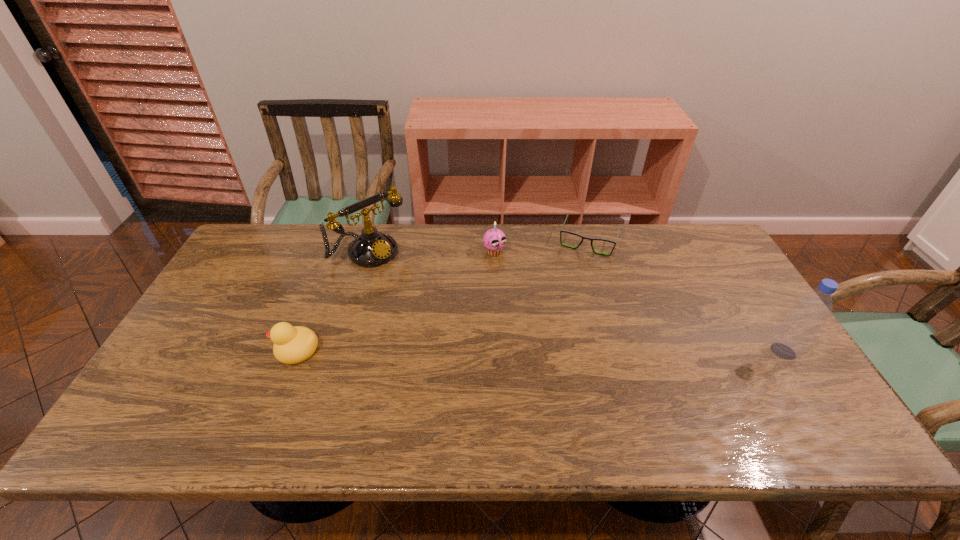
Image resolution: width=960 pixels, height=540 pixels. I want to click on cupcake that is at the far edge, so click(494, 239).

Locate an element on the screen. This screenshot has height=540, width=960. telephone at the far edge is located at coordinates (372, 248).

Identify the location of spectacles that is at the far edge. The height and width of the screenshot is (540, 960). (565, 231).

Identify the location of object positioned at the right edge. (791, 339).

Identify the location of vacant position at the far edge of the desktop. Image resolution: width=960 pixels, height=540 pixels. (576, 228).

Where is `vacant space at the near edge of the desktop`? vacant space at the near edge of the desktop is located at coordinates point(746,397).

In the image, there is a desktop. At what (x,y) coordinates should I click in order to perform the action: click on free space at the left edge. Please return your answer as a coordinate pair (x, y). The height and width of the screenshot is (540, 960). Looking at the image, I should click on (188, 347).

At what (x,y) coordinates should I click in order to perform the action: click on vacant space at the right edge of the desktop. Please return your answer as a coordinate pair (x, y). The width and height of the screenshot is (960, 540). Looking at the image, I should click on (756, 343).

This screenshot has height=540, width=960. Find the location of `blank area at the far left corner`. blank area at the far left corner is located at coordinates (283, 253).

Where is `vacant space at the near left corner of the desktop`? Image resolution: width=960 pixels, height=540 pixels. vacant space at the near left corner of the desktop is located at coordinates pyautogui.click(x=190, y=402).